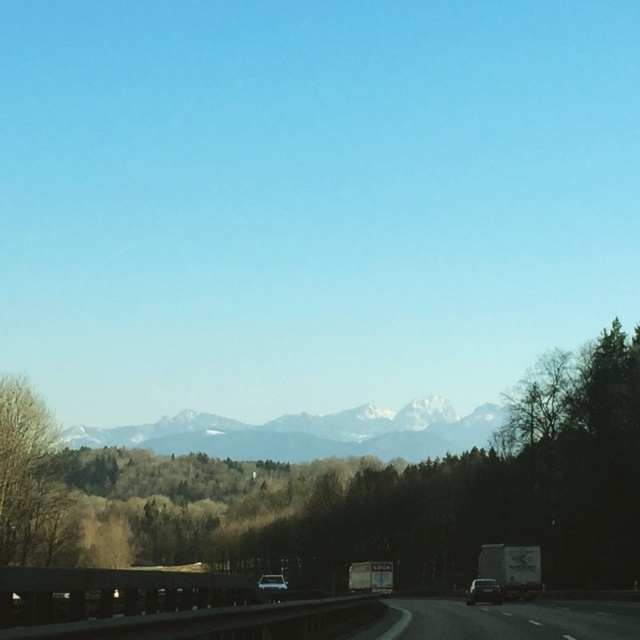
Measure the distance between shiny black car at center and camera.

48.60 meters

Is point (490, 598) positioned after point (285, 588)?

No, it is in front of (285, 588).

Find the location of a particular element. shiny black car at center is located at coordinates (483, 592).

Is snowy granite mountain range at center shorter than shiny black car at center?

Incorrect, snowy granite mountain range at center's height does not fall short of shiny black car at center's.

How far apart are snowy granite mountain range at center and shiny black car at center?

They are 122.06 meters apart.

Does point (403, 451) lie behind point (474, 598)?

Yes, it is behind point (474, 598).

At what (x,y) coordinates should I click in order to perform the action: click on snowy granite mountain range at center. Please return your answer as a coordinate pair (x, y). This screenshot has width=640, height=640. Looking at the image, I should click on (308, 433).

Who is shorter, snowy granite mountain range at center or metallic silver car at center?

With less height is metallic silver car at center.

Between snowy granite mountain range at center and metallic silver car at center, which one has more height?

Standing taller between the two is snowy granite mountain range at center.

Which is in front, point (218, 444) or point (259, 579)?

Point (259, 579)

I want to click on snowy granite mountain range at center, so click(x=308, y=433).